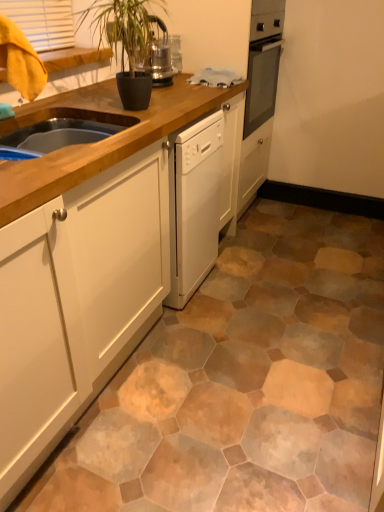
Locate an element on the screen. The width and height of the screenshot is (384, 512). free spot below dark green glossy plant at upper center (from a real-world perspective) is located at coordinates (145, 104).